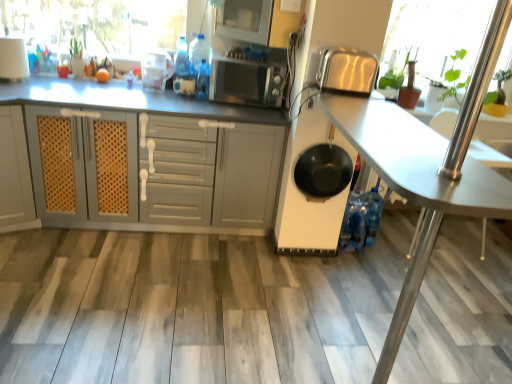
Find the location of a particular element. This screenshot has width=512, height=384. vacant space to the left of metallic silver table at center is located at coordinates (190, 321).